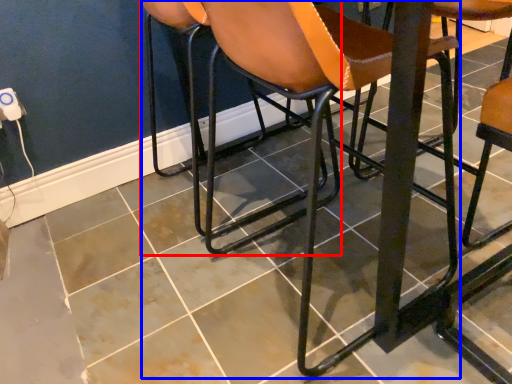
Question: Which of the following is the farthest to the observer, chair (highlighted by a red box) or chair (highlighted by a blue box)?

Choices:
 (A) chair
 (B) chair

Answer: (A)